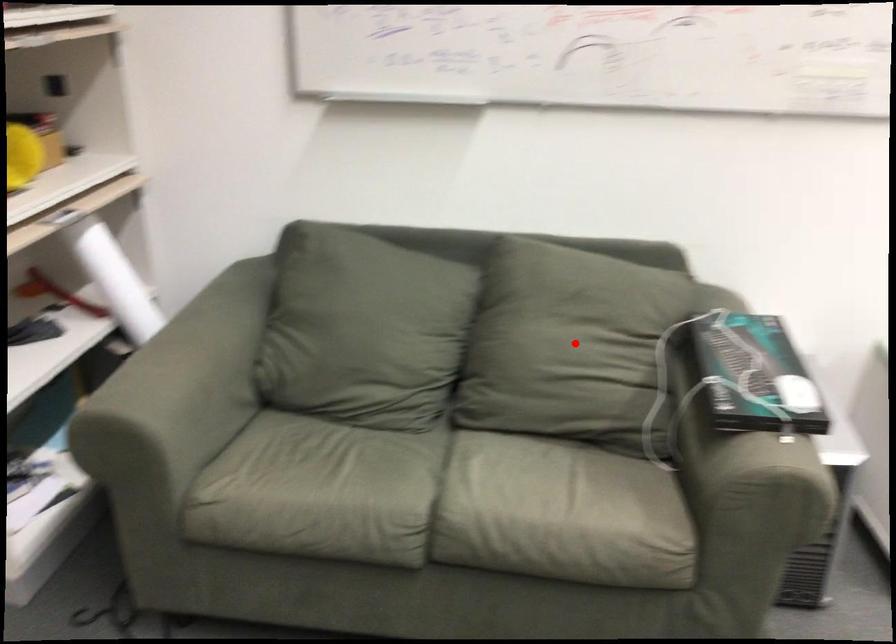
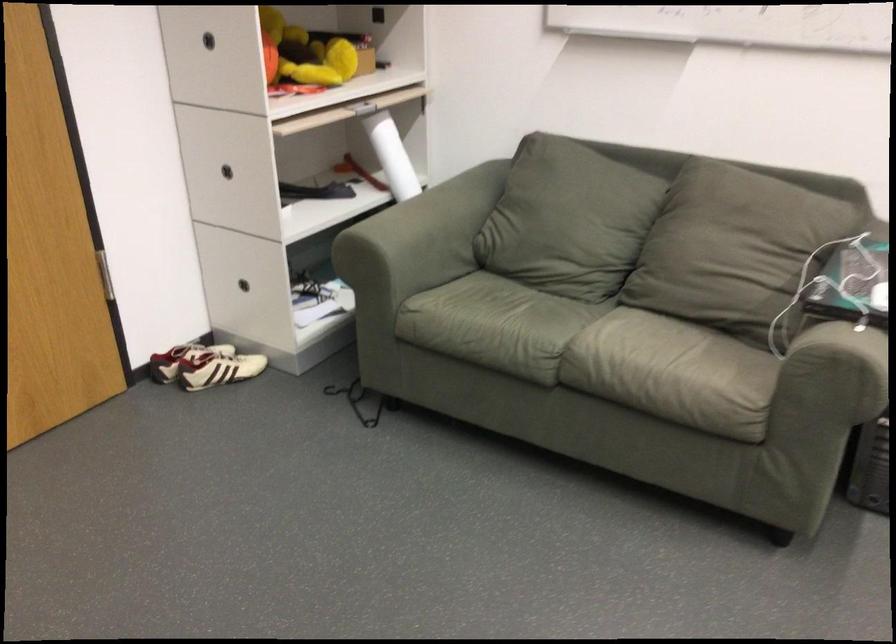
Question: A red point is marked in image1. In image2, is the corresponding 3D point closer to the camera or farther? Reply with the corresponding letter.

Choices:
 (A) The corresponding 3D point is closer.
 (B) The corresponding 3D point is farther.

Answer: (B)